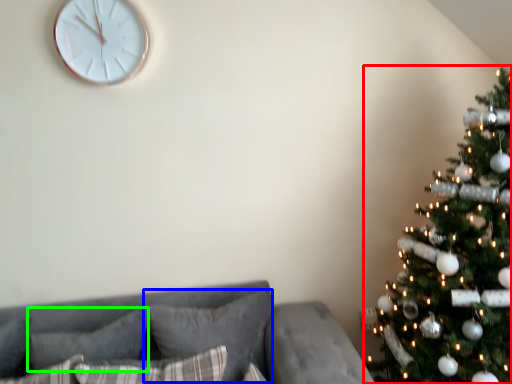
Question: Which object is the farthest from christmas tree (highlighted by a red box)? Choose among these: pillow (highlighted by a blue box) or pillow (highlighted by a green box).

Choices:
 (A) pillow
 (B) pillow

Answer: (B)